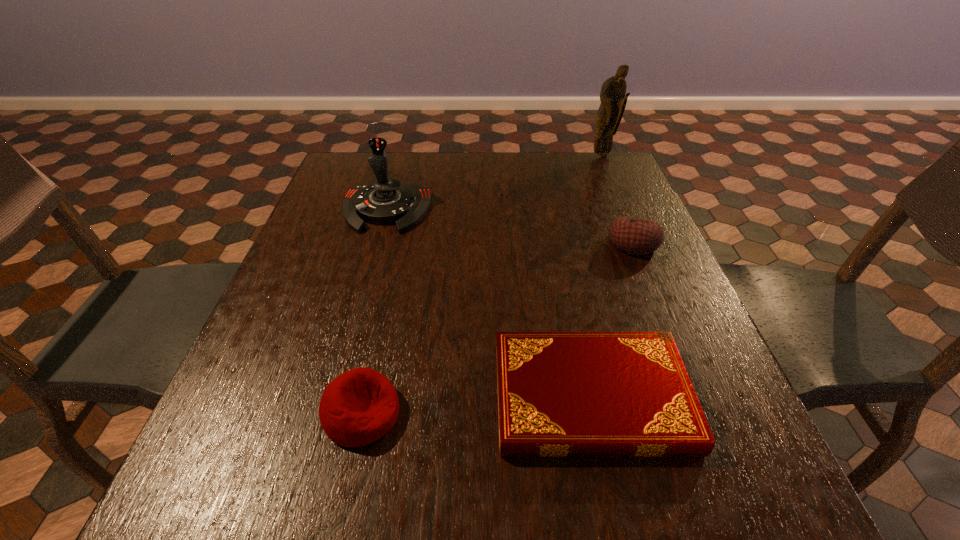
Where is `free spot located 0.260m on the cover of the hardback book`? free spot located 0.260m on the cover of the hardback book is located at coordinates (349, 397).

Locate an element on the screen. The width and height of the screenshot is (960, 540). vacant space located on the cover of the hardback book is located at coordinates (400, 397).

This screenshot has height=540, width=960. What are the coordinates of `vacant space located 0.380m on the cover of the hardback book` in the screenshot? It's located at (281, 397).

Find the location of a particular element. This screenshot has width=960, height=540. figurine that is at the far edge is located at coordinates (612, 96).

In order to click on joystick that is at the far edge in this screenshot , I will do `click(387, 201)`.

You are a GUI agent. You are given a task and a screenshot of the screen. Output one action in this format:
    pyautogui.click(x=<x>, y=<y>)
    Task: Click on the object that is at the left edge
    The height and width of the screenshot is (540, 960).
    Given the screenshot: What is the action you would take?
    387,201

Image resolution: width=960 pixels, height=540 pixels. Identify the location of figurine situated at the right edge. (x=612, y=96).

You are a GUI agent. You are given a task and a screenshot of the screen. Output one action in this format:
    pyautogui.click(x=<x>, y=<y>)
    Task: Click on the beanbag that is at the right edge
    
    Given the screenshot: What is the action you would take?
    pyautogui.click(x=635, y=236)

You are a GUI agent. You are given a task and a screenshot of the screen. Output one action in this format:
    pyautogui.click(x=<x>, y=<y>)
    Task: Click on the hardback book present at the right edge
    
    Given the screenshot: What is the action you would take?
    pyautogui.click(x=560, y=394)

Locate an element on the screen. This screenshot has height=540, width=960. object positioned at the far left corner is located at coordinates (387, 201).